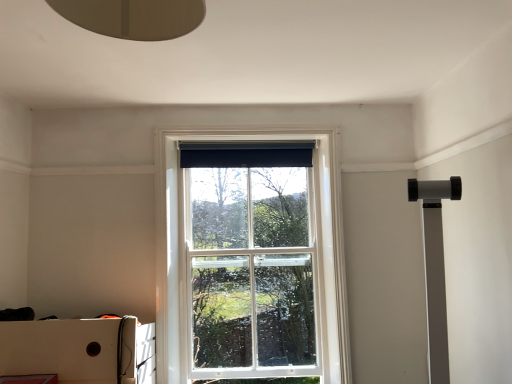
Question: Can you confirm if white cardboard box at lower left is shorter than black fabric curtain at upper center?

Choices:
 (A) no
 (B) yes

Answer: (A)

Question: From a real-world perspective, does white cardboard box at lower left stand above black fabric curtain at upper center?

Choices:
 (A) yes
 (B) no

Answer: (B)

Question: Considering the relative sizes of white cardboard box at lower left and black fabric curtain at upper center in the image provided, is white cardboard box at lower left smaller than black fabric curtain at upper center?

Choices:
 (A) no
 (B) yes

Answer: (A)

Question: Can you confirm if white cardboard box at lower left is positioned to the left of black fabric curtain at upper center?

Choices:
 (A) no
 (B) yes

Answer: (B)

Question: Does white cardboard box at lower left come in front of black fabric curtain at upper center?

Choices:
 (A) no
 (B) yes

Answer: (B)

Question: Is black fabric curtain at upper center inside white cardboard box at lower left?

Choices:
 (A) yes
 (B) no

Answer: (B)

Question: Are white glass window at center and black fabric curtain at upper center making contact?

Choices:
 (A) yes
 (B) no

Answer: (B)

Question: Does white glass window at center come in front of black fabric curtain at upper center?

Choices:
 (A) yes
 (B) no

Answer: (A)

Question: Is white glass window at center not near black fabric curtain at upper center?

Choices:
 (A) yes
 (B) no

Answer: (B)

Question: Does white glass window at center turn towards black fabric curtain at upper center?

Choices:
 (A) yes
 (B) no

Answer: (A)

Question: Does white glass window at center appear on the right side of black fabric curtain at upper center?

Choices:
 (A) yes
 (B) no

Answer: (B)

Question: Is white glass window at center thinner than black fabric curtain at upper center?

Choices:
 (A) no
 (B) yes

Answer: (A)

Question: From the image's perspective, would you say white cardboard box at lower left is shown under white glass window at center?

Choices:
 (A) no
 (B) yes

Answer: (B)